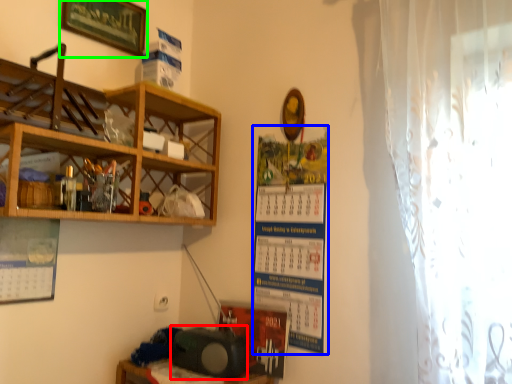
Question: Considering the real-world distances, which object is closest to speaker (highlighted by a red box)? poster (highlighted by a blue box) or picture frame (highlighted by a green box).

Choices:
 (A) poster
 (B) picture frame

Answer: (A)